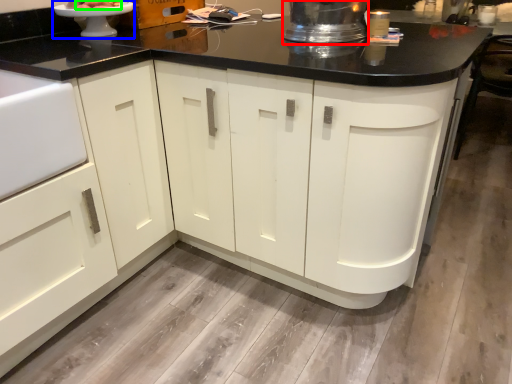
Question: Based on their relative distances, which object is nearer to appliance (highlighted by a red box)? Choose from appliance (highlighted by a blue box) and food (highlighted by a green box).

Choices:
 (A) appliance
 (B) food

Answer: (A)